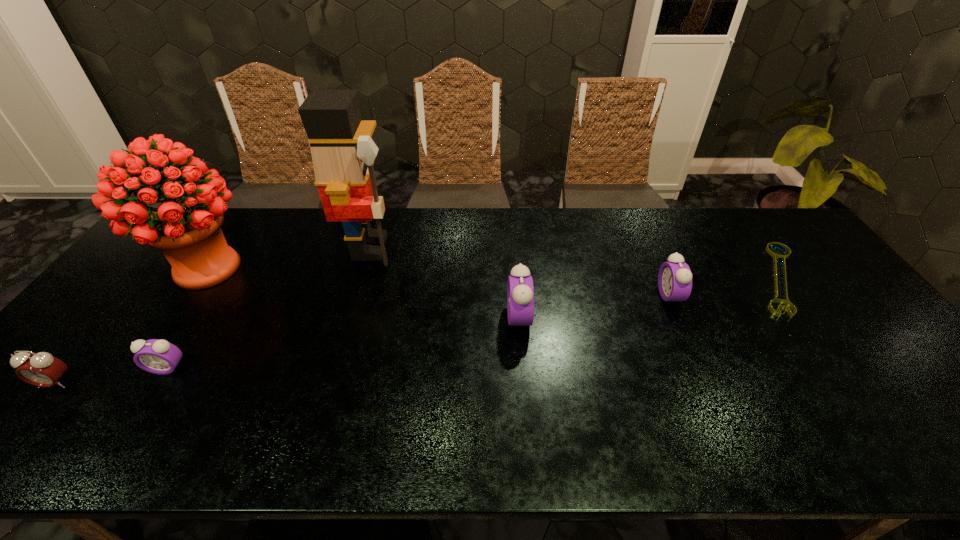
Image resolution: width=960 pixels, height=540 pixels. In order to click on object located at the near left corner in this screenshot , I will do `click(41, 369)`.

The height and width of the screenshot is (540, 960). I want to click on object that is at the far right corner, so click(x=781, y=256).

The width and height of the screenshot is (960, 540). In order to click on free spot at the far edge of the desktop in this screenshot , I will do `click(269, 233)`.

Where is `vacant space at the near edge of the desktop`? vacant space at the near edge of the desktop is located at coordinates (443, 399).

The width and height of the screenshot is (960, 540). In the image, there is a desktop. Identify the location of vacant space at the left edge. (134, 334).

At what (x,y) coordinates should I click in order to perform the action: click on free space at the right edge. Please return your answer as a coordinate pair (x, y). Image resolution: width=960 pixels, height=540 pixels. Looking at the image, I should click on (866, 341).

In the image, there is a desktop. At what (x,y) coordinates should I click in order to perform the action: click on vacant space at the near right corner. Please return your answer as a coordinate pair (x, y). The width and height of the screenshot is (960, 540). Looking at the image, I should click on (887, 382).

Locate an element on the screen. This screenshot has width=960, height=540. vacant area that lies between the shortest object and the fifth shortest object is located at coordinates (649, 298).

The image size is (960, 540). Identify the location of free space between the third farthest alarm clock and the nearest object. (111, 376).

Where is `empty space that is in between the fifth object from left to right and the rightmost object`? The height and width of the screenshot is (540, 960). empty space that is in between the fifth object from left to right and the rightmost object is located at coordinates (649, 298).